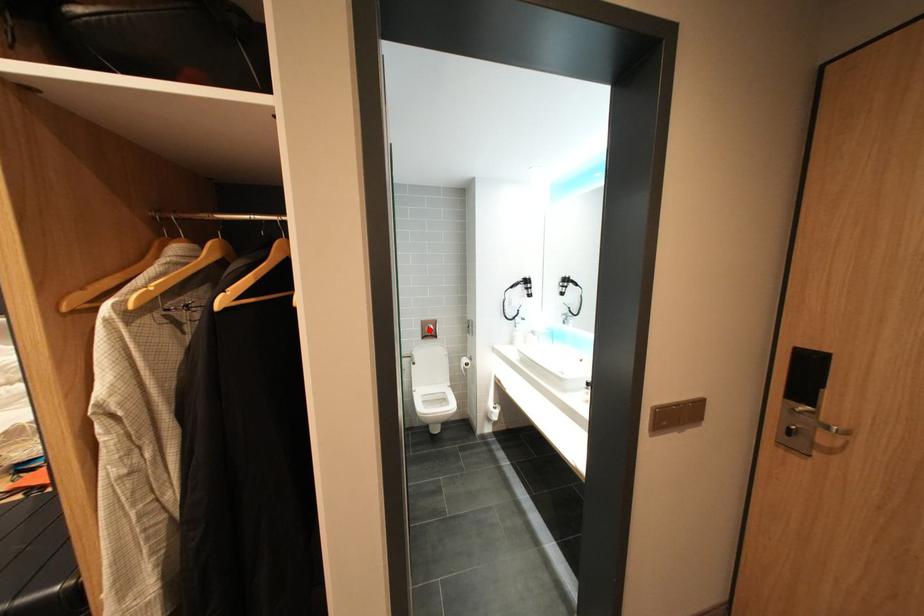
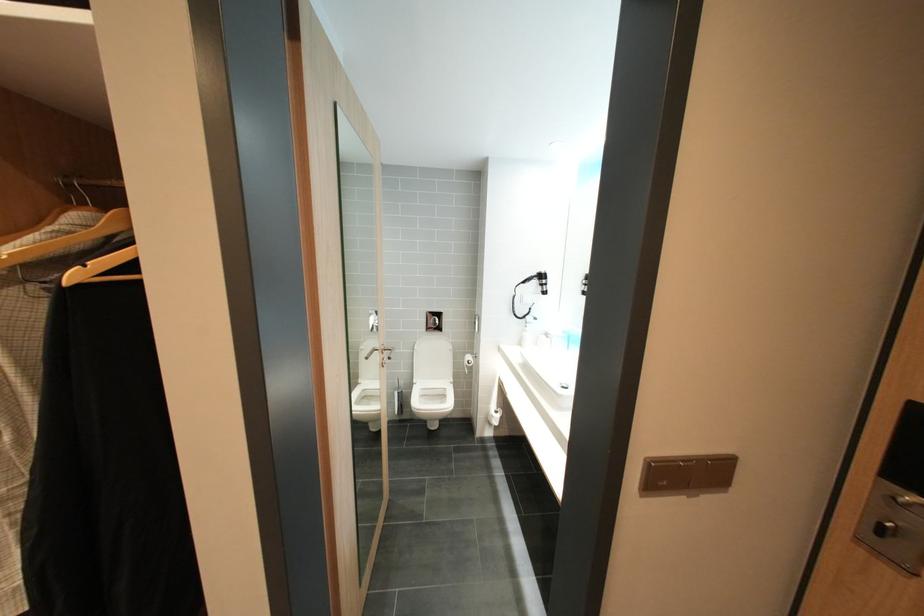
The point at the highlighted location is marked in the first image. Where is the corresponding point in the second image?

(434, 321)